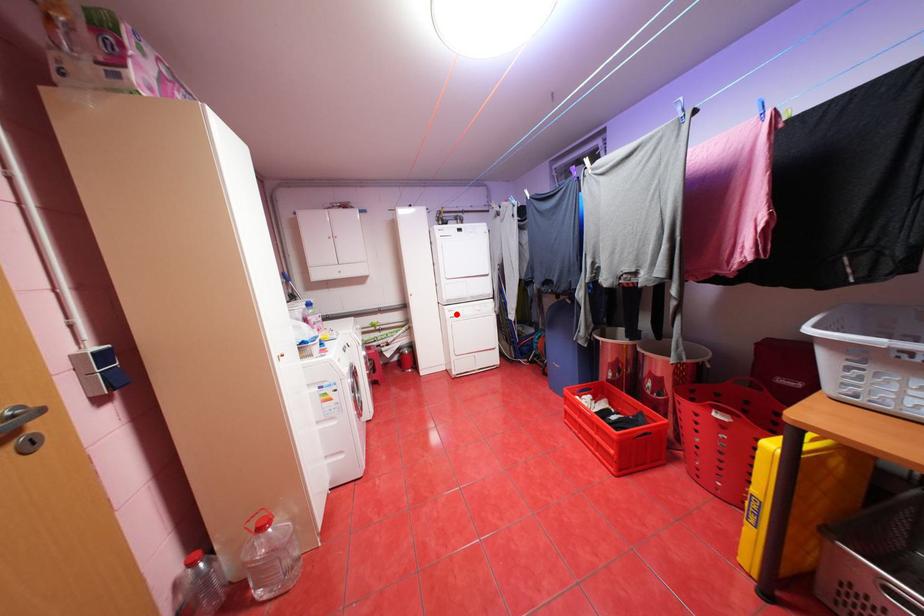
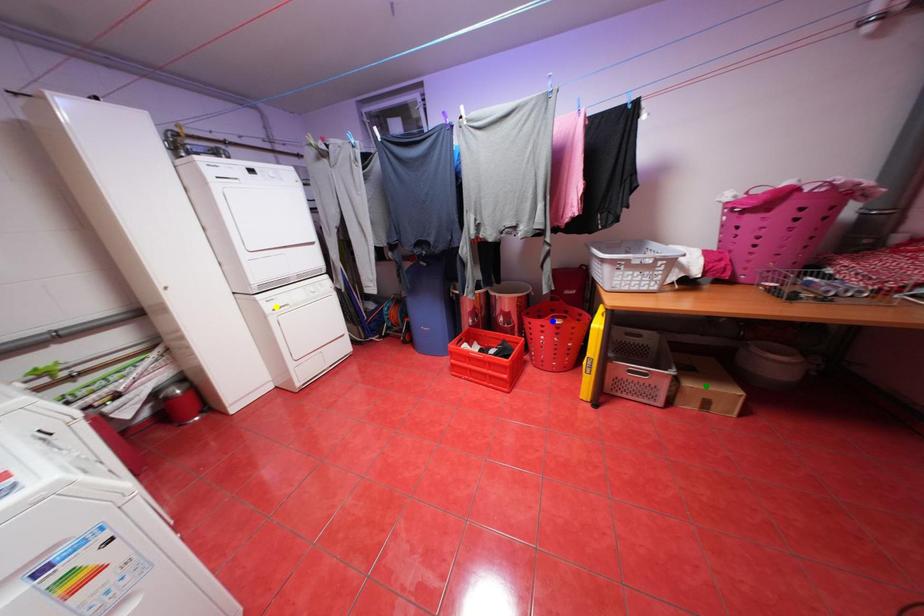
Question: I am providing you with two images of the same scene from different viewpoints. A red point is marked on the first image. You are given multiple points on the second image. In image 2, which mark is for the same physical point as the one in image 1?

Choices:
 (A) green point
 (B) blue point
 (C) yellow point

Answer: (C)